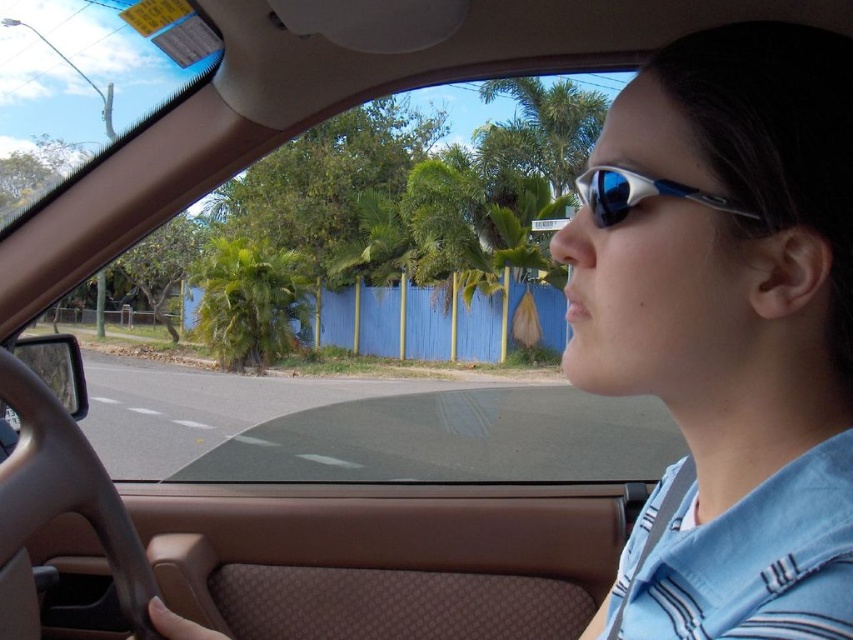
You are a passenger in the car and want to compare the sizes of the blue reflective sunglasses at center and the green leafy palm tree at center visible through the windshield. Which object appears smaller in width?

The blue reflective sunglasses at center appears smaller in width than the green leafy palm tree at center because its width is less than the palm tree.

You are a passenger in the car and want to know which object takes up more space in the driver side view. Which one is larger between the blue reflective sunglasses at center and the green leafy palm tree at center?

The green leafy palm tree at center takes up more space than the blue reflective sunglasses at center in the driver side view.

You are sitting in the driver seat of the car and looking through the windshield. You see the blue reflective sunglasses at center and the green leafy palm tree at center. Which object is closer to you?

The blue reflective sunglasses at center is closer to you because it is in front of the green leafy palm tree at center.